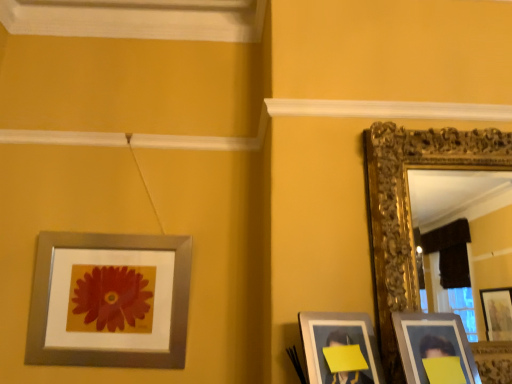
Question: From a real-world perspective, is silver metallic picture frame at upper left, the fourth picture frame viewed from the right, positioned above or below matte silver picture frame at lower right, which ranks as the third picture frame in left-to-right order?

Choices:
 (A) below
 (B) above

Answer: (B)

Question: In terms of width, does silver metallic picture frame at upper left, the fourth picture frame viewed from the right, look wider or thinner when compared to matte silver picture frame at lower right, the second picture frame when ordered from right to left?

Choices:
 (A) thin
 (B) wide

Answer: (B)

Question: Which is farther from the matte silver picture frame at lower right, the second picture frame when ordered from right to left?

Choices:
 (A) silver metallic picture frame at upper left, which is the first picture frame in left-to-right order
 (B) gold ornate mirror at right, the 4th picture frame viewed from the left
 (C) matte silver picture frame at lower right, which is the third picture frame in right-to-left order

Answer: (A)

Question: Estimate the real-world distances between objects in this image. Which object is closer to the matte silver picture frame at lower right, which ranks as the third picture frame in left-to-right order?

Choices:
 (A) matte silver picture frame at lower right, which is the third picture frame in right-to-left order
 (B) silver metallic picture frame at upper left, the fourth picture frame viewed from the right
 (C) gold ornate mirror at right, the 4th picture frame viewed from the left

Answer: (A)